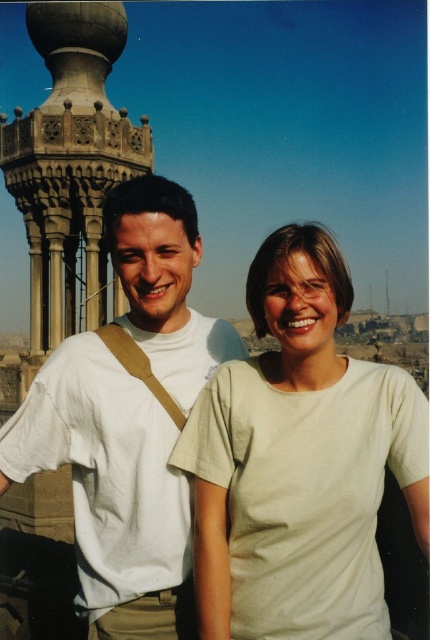
You are standing on the rooftop and looking at two points marked in the image. Which point is closer to you, point (325, 424) or point (160, 406)?

Point (325, 424) is in front of point (160, 406), so it is closer to you.